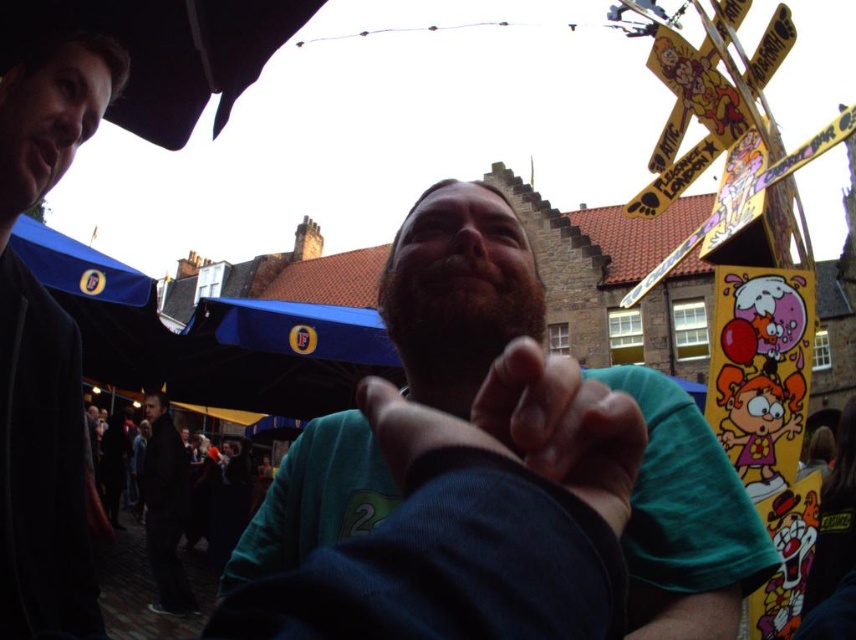
Question: Can you confirm if green matte hand at center is smaller than dark gray suit at lower left?

Choices:
 (A) no
 (B) yes

Answer: (A)

Question: Which of the following is the closest to the observer?

Choices:
 (A) dark blue jacket at left
 (B) green matte hand at center
 (C) dark gray suit at lower left

Answer: (B)

Question: Can you confirm if green matte hand at center is positioned to the left of dark gray suit at lower left?

Choices:
 (A) no
 (B) yes

Answer: (A)

Question: From the image, what is the correct spatial relationship of dark blue jacket at left in relation to green matte hand at center?

Choices:
 (A) below
 (B) above

Answer: (B)

Question: Which object is closer to the camera taking this photo?

Choices:
 (A) dark blue jacket at left
 (B) dark gray suit at lower left

Answer: (A)

Question: Which point is farther to the camera?

Choices:
 (A) (39, 467)
 (B) (293, 461)
 (C) (548, 448)
 (D) (155, 442)

Answer: (D)